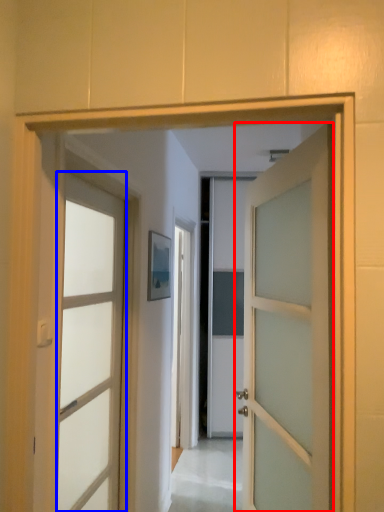
Question: Which point is further to the camera, door (highlighted by a red box) or door (highlighted by a blue box)?

Choices:
 (A) door
 (B) door

Answer: (B)